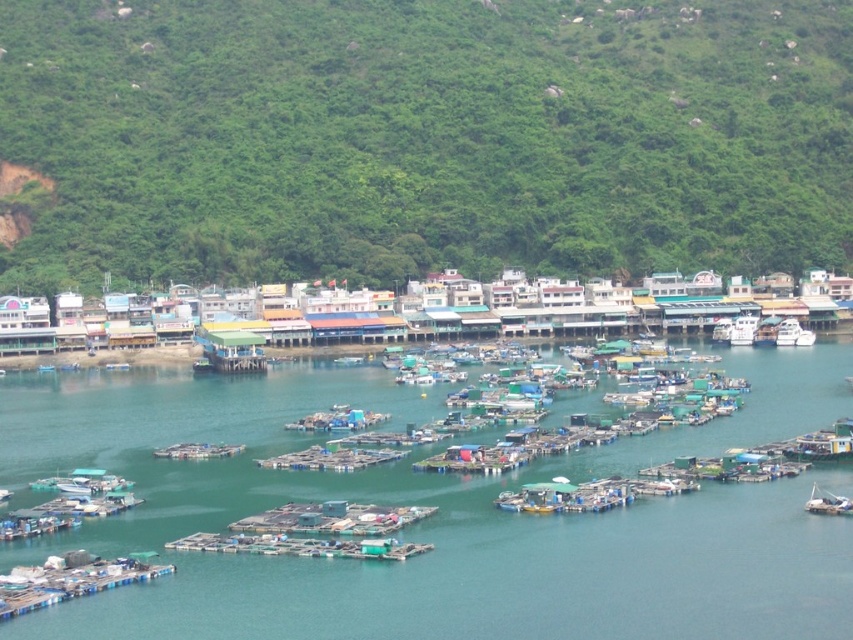
You are standing on the dock and looking at the green water at center and the green plastic boats at center. Which one appears nearer to you?

The green water at center appears nearer to you because it is closer to the viewer than the green plastic boats at center.

You are a photographer planning to capture the harbor scene. You want to ensure that both the green leafy hillside at upper center and the green plastic boats at center are clearly visible in your photo. Given their sizes, which object will occupy more space in the final image?

The green leafy hillside at upper center will occupy more space in the final image because it has a larger size compared to the green plastic boats at center.